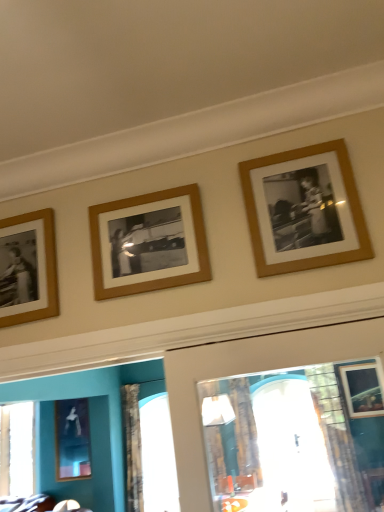
Question: Should I look upward or downward to see wooden frame at center, arranged as the third picture frame when ordered from the bottom?

Choices:
 (A) down
 (B) up

Answer: (B)

Question: Is wooden photo frame at left, acting as the 2th picture frame starting from the left, beside metallic silver frame at lower left, the 1th picture frame in the bottom-to-top sequence?

Choices:
 (A) no
 (B) yes

Answer: (A)

Question: Is metallic silver frame at lower left, which is the 1th picture frame in left-to-right order, at the back of wooden photo frame at left, the 3th picture frame from the top?

Choices:
 (A) no
 (B) yes

Answer: (A)

Question: Is wooden photo frame at left, the 3th picture frame from the top, positioned far away from metallic silver frame at lower left, placed as the fourth picture frame when sorted from right to left?

Choices:
 (A) yes
 (B) no

Answer: (A)

Question: Is metallic silver frame at lower left, which is counted as the fourth picture frame, starting from the top, surrounded by wooden photo frame at left, the 3th picture frame from the top?

Choices:
 (A) no
 (B) yes

Answer: (A)

Question: From the image's perspective, is wooden photo frame at left, placed as the second picture frame when sorted from back to front, located beneath metallic silver frame at lower left, which is counted as the fourth picture frame, starting from the top?

Choices:
 (A) yes
 (B) no

Answer: (B)

Question: Considering the relative sizes of wooden photo frame at left, the 3th picture frame from the top, and metallic silver frame at lower left, acting as the fourth picture frame starting from the front, in the image provided, is wooden photo frame at left, the 3th picture frame from the top, thinner than metallic silver frame at lower left, acting as the fourth picture frame starting from the front,?

Choices:
 (A) yes
 (B) no

Answer: (A)

Question: From a real-world perspective, is wooden photo frame at upper right, positioned as the 4th picture frame in bottom-to-top order, beneath wooden photo frame at left, placed as the second picture frame when sorted from back to front?

Choices:
 (A) no
 (B) yes

Answer: (B)

Question: Is wooden photo frame at upper right, acting as the 1th picture frame starting from the front, wider than wooden photo frame at left, acting as the 2th picture frame starting from the left?

Choices:
 (A) yes
 (B) no

Answer: (B)

Question: From the image's perspective, is wooden photo frame at upper right, which ranks as the fourth picture frame in left-to-right order, under wooden photo frame at left, acting as the 2th picture frame starting from the left?

Choices:
 (A) no
 (B) yes

Answer: (A)

Question: From the image's perspective, is wooden photo frame at upper right, which appears as the 1th picture frame when viewed from the top, on wooden photo frame at left, marked as the second picture frame in a bottom-to-top arrangement?

Choices:
 (A) yes
 (B) no

Answer: (A)

Question: Is wooden photo frame at upper right, positioned as the 4th picture frame in bottom-to-top order, positioned with its back to wooden photo frame at left, which is counted as the third picture frame, starting from the right?

Choices:
 (A) yes
 (B) no

Answer: (B)

Question: Is the depth of wooden photo frame at upper right, acting as the first picture frame starting from the right, less than that of wooden photo frame at left, which is counted as the third picture frame, starting from the right?

Choices:
 (A) no
 (B) yes

Answer: (B)

Question: From the image's perspective, does wooden frame at center, placed as the 2th picture frame when sorted from top to bottom, appear lower than metallic silver frame at lower left, which is the 1th picture frame in left-to-right order?

Choices:
 (A) yes
 (B) no

Answer: (B)